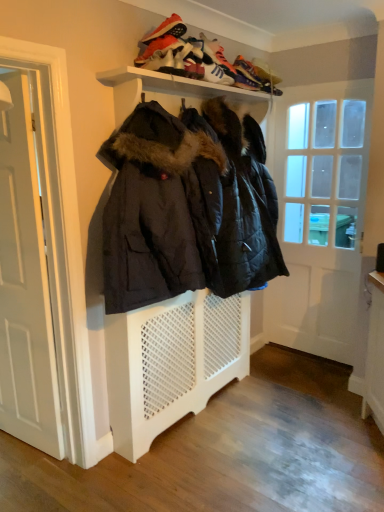
The width and height of the screenshot is (384, 512). Describe the element at coordinates (160, 62) in the screenshot. I see `white suede sneaker at upper center, which ranks as the first shoe in front-to-back order` at that location.

Measure the distance between white leather sneaker at upper center, placed as the third shoe when sorted from front to back, and camera.

The distance of white leather sneaker at upper center, placed as the third shoe when sorted from front to back, from camera is 2.18 meters.

Measure the distance between point (225, 265) and camera.

Point (225, 265) is 2.38 meters away from camera.

What do you see at coordinates (318, 214) in the screenshot? Image resolution: width=384 pixels, height=512 pixels. I see `white glossy door at right, the first door from the back` at bounding box center [318, 214].

Measure the distance between white glossy door at right, arranged as the second door when viewed from the front, and camera.

The distance of white glossy door at right, arranged as the second door when viewed from the front, from camera is 8.78 feet.

This screenshot has height=512, width=384. In order to click on leather suede sneaker at upper center, which ranks as the second shoe in front-to-back order in this screenshot , I will do `click(182, 61)`.

Image resolution: width=384 pixels, height=512 pixels. What are the coordinates of `white suede sneaker at upper center, which ranks as the first shoe in front-to-back order` in the screenshot? It's located at (160, 62).

Is white glossy door at right, placed as the second door when sorted from left to right, placed right next to white suede sneaker at upper center, which ranks as the first shoe in front-to-back order?

No, white glossy door at right, placed as the second door when sorted from left to right, is not in contact with white suede sneaker at upper center, which ranks as the first shoe in front-to-back order.

From the image's perspective, between white glossy door at right, the 1th door viewed from the right, and white suede sneaker at upper center, which ranks as the first shoe in front-to-back order, who is located below?

white glossy door at right, the 1th door viewed from the right, from the image's perspective.

Which object is further away from the camera, white glossy door at right, the first door from the back, or white suede sneaker at upper center, which ranks as the first shoe in front-to-back order?

white glossy door at right, the first door from the back, is behind.

Considering the sizes of objects white glossy door at right, the first door from the back, and white suede sneaker at upper center, which ranks as the first shoe in front-to-back order, in the image provided, who is smaller, white glossy door at right, the first door from the back, or white suede sneaker at upper center, which ranks as the first shoe in front-to-back order,?

Smaller between the two is white suede sneaker at upper center, which ranks as the first shoe in front-to-back order.

Relative to white suede sneaker at upper center, the 4th shoe when ordered from back to front, is shiny orange sneaker at upper center, which is counted as the 1th shoe, starting from the back, in front or behind?

shiny orange sneaker at upper center, which is counted as the 1th shoe, starting from the back, is positioned farther from the viewer than white suede sneaker at upper center, the 4th shoe when ordered from back to front.

From the image's perspective, which one is positioned lower, shiny orange sneaker at upper center, which is the 4th shoe in front-to-back order, or white suede sneaker at upper center, which ranks as the first shoe in front-to-back order?

white suede sneaker at upper center, which ranks as the first shoe in front-to-back order, is shown below in the image.

Can you confirm if shiny orange sneaker at upper center, which is the 4th shoe in front-to-back order, is taller than white suede sneaker at upper center, the 4th shoe when ordered from back to front?

Yes, shiny orange sneaker at upper center, which is the 4th shoe in front-to-back order, is taller than white suede sneaker at upper center, the 4th shoe when ordered from back to front.

From the image's perspective, which shoe is the 3rd one below the shiny orange sneaker at upper center, which is counted as the 1th shoe, starting from the back? Please provide its 2D coordinates.

[(160, 62)]

Could you measure the distance between white glossy door at right, the first door from the back, and white matte shelf at upper center?

The distance of white glossy door at right, the first door from the back, from white matte shelf at upper center is 98.68 centimeters.

Find the location of a particular element. This screenshot has height=512, width=384. the 1st door located beneath the white matte shelf at upper center (from a real-world perspective) is located at coordinates (318, 214).

Could you tell me if white glossy door at right, the 1th door viewed from the right, is turned towards white matte shelf at upper center?

Yes, white glossy door at right, the 1th door viewed from the right, is turned towards white matte shelf at upper center.

Is white glossy door at right, arranged as the second door when viewed from the front, beside white matte shelf at upper center?

No, white glossy door at right, arranged as the second door when viewed from the front, is not in contact with white matte shelf at upper center.

Considering the relative sizes of matte black jackets at center and orange suede sneaker at upper center in the image provided, is matte black jackets at center thinner than orange suede sneaker at upper center?

No, matte black jackets at center is not thinner than orange suede sneaker at upper center.

Is orange suede sneaker at upper center surrounded by matte black jackets at center?

That's incorrect, orange suede sneaker at upper center is not inside matte black jackets at center.

Is matte black jackets at center facing towards orange suede sneaker at upper center?

No, matte black jackets at center is not oriented towards orange suede sneaker at upper center.

Considering the relative sizes of matte black jackets at center and orange suede sneaker at upper center in the image provided, is matte black jackets at center bigger than orange suede sneaker at upper center?

Yes.

How distant is leather suede sneaker at upper center, which ranks as the second shoe in front-to-back order, from matte black jackets at center?

leather suede sneaker at upper center, which ranks as the second shoe in front-to-back order, and matte black jackets at center are 82.50 centimeters apart from each other.

From a real-world perspective, who is located lower, leather suede sneaker at upper center, which ranks as the 3th shoe in back-to-front order, or matte black jackets at center?

From a 3D spatial view, matte black jackets at center is below.

Are leather suede sneaker at upper center, which ranks as the 3th shoe in back-to-front order, and matte black jackets at center located far from each other?

Actually, leather suede sneaker at upper center, which ranks as the 3th shoe in back-to-front order, and matte black jackets at center are a little close together.

Looking at this image, can you confirm if matte black jackets at center is smaller than white suede sneaker at upper center, the 4th shoe when ordered from back to front?

Actually, matte black jackets at center might be larger than white suede sneaker at upper center, the 4th shoe when ordered from back to front.

Considering the positions of objects matte black jackets at center and white suede sneaker at upper center, which ranks as the first shoe in front-to-back order, in the image provided, who is behind, matte black jackets at center or white suede sneaker at upper center, which ranks as the first shoe in front-to-back order,?

white suede sneaker at upper center, which ranks as the first shoe in front-to-back order, is further away from the camera.

Between point (124, 205) and point (152, 70), which one is positioned behind?

The point (152, 70) is behind.

Can you confirm if white wooden door at left, the first door in the front-to-back sequence, is shorter than leather suede sneaker at upper center, which ranks as the second shoe in front-to-back order?

In fact, white wooden door at left, the first door in the front-to-back sequence, may be taller than leather suede sneaker at upper center, which ranks as the second shoe in front-to-back order.

Image resolution: width=384 pixels, height=512 pixels. Identify the location of the 2nd shoe behind the white wooden door at left, acting as the first door starting from the left. (182, 61).

From a real-world perspective, is white wooden door at left, the first door in the front-to-back sequence, beneath leather suede sneaker at upper center, which ranks as the 3th shoe in back-to-front order?

Yes, from a real-world perspective, white wooden door at left, the first door in the front-to-back sequence, is beneath leather suede sneaker at upper center, which ranks as the 3th shoe in back-to-front order.

In terms of size, does white wooden door at left, the first door in the front-to-back sequence, appear bigger or smaller than leather suede sneaker at upper center, which ranks as the second shoe in front-to-back order?

Clearly, white wooden door at left, the first door in the front-to-back sequence, is larger in size than leather suede sneaker at upper center, which ranks as the second shoe in front-to-back order.

You are a GUI agent. You are given a task and a screenshot of the screen. Output one action in this format:
    pyautogui.click(x=<x>, y=<y>)
    Task: Click on the door that is the 1st object located below the white suede sneaker at upper center, which ranks as the first shoe in front-to-back order (from the image's perspective)
    
    Given the screenshot: What is the action you would take?
    pyautogui.click(x=318, y=214)

From a real-world perspective, which shoe is the 2nd one underneath the shiny orange sneaker at upper center, which is counted as the 1th shoe, starting from the back? Please provide its 2D coordinates.

[(160, 62)]

Estimate the real-world distances between objects in this image. Which object is closer to white glossy door at right, arranged as the second door when viewed from the front, orange suede sneaker at upper center or white wooden door at left, acting as the first door starting from the left?

orange suede sneaker at upper center is closer to white glossy door at right, arranged as the second door when viewed from the front.

Estimate the real-world distances between objects in this image. Which object is further from white matte shelf at upper center, white wooden door at left, which is the 2th door in right-to-left order, or orange suede sneaker at upper center?

white wooden door at left, which is the 2th door in right-to-left order, is positioned further to the anchor white matte shelf at upper center.

Looking at this image, which object lies further to the anchor point white leather sneaker at upper center, which ranks as the second shoe in back-to-front order, shiny orange sneaker at upper center, which is the 4th shoe in front-to-back order, or white suede sneaker at upper center, which ranks as the first shoe in front-to-back order?

white suede sneaker at upper center, which ranks as the first shoe in front-to-back order, lies further to white leather sneaker at upper center, which ranks as the second shoe in back-to-front order, than the other object.

When comparing their distances from white leather sneaker at upper center, which ranks as the second shoe in back-to-front order, does shiny orange sneaker at upper center, which is counted as the 1th shoe, starting from the back, or white wooden door at left, which is the 2th door in right-to-left order, seem further?

Among the two, white wooden door at left, which is the 2th door in right-to-left order, is located further to white leather sneaker at upper center, which ranks as the second shoe in back-to-front order.

Consider the image. Considering their positions, is leather suede sneaker at upper center, which ranks as the 3th shoe in back-to-front order, positioned further to white glossy door at right, arranged as the second door when viewed from the front, than orange suede sneaker at upper center?

orange suede sneaker at upper center.

Looking at this image, based on their spatial positions, is white glossy door at right, the first door from the back, or shiny orange sneaker at upper center, which is counted as the 1th shoe, starting from the back, further from white wooden door at left, acting as the first door starting from the left?

white glossy door at right, the first door from the back, is further to white wooden door at left, acting as the first door starting from the left.

Looking at the image, which one is located closer to white glossy door at right, the 1th door viewed from the right, white leather sneaker at upper center, placed as the third shoe when sorted from front to back, or white suede sneaker at upper center, which ranks as the first shoe in front-to-back order?

white leather sneaker at upper center, placed as the third shoe when sorted from front to back.

Considering their positions, is orange suede sneaker at upper center positioned further to shiny orange sneaker at upper center, which is counted as the 1th shoe, starting from the back, than matte black jackets at center?

Among the two, matte black jackets at center is located further to shiny orange sneaker at upper center, which is counted as the 1th shoe, starting from the back.

What are the coordinates of `shelf between white leather sneaker at upper center, which ranks as the second shoe in back-to-front order, and matte black jackets at center, in the vertical direction` in the screenshot? It's located at (179, 85).

The height and width of the screenshot is (512, 384). What are the coordinates of `shelf between leather suede sneaker at upper center, which ranks as the 3th shoe in back-to-front order, and white wooden door at left, arranged as the second door when viewed from the back, from top to bottom` in the screenshot? It's located at (179, 85).

Identify the location of closet between orange suede sneaker at upper center and white wooden door at left, acting as the first door starting from the left, in the vertical direction. The image size is (384, 512). (181, 253).

Find the location of `footwear between white suede sneaker at upper center, which ranks as the first shoe in front-to-back order, and white matte shelf at upper center from left to right`. footwear between white suede sneaker at upper center, which ranks as the first shoe in front-to-back order, and white matte shelf at upper center from left to right is located at coordinates (162, 35).